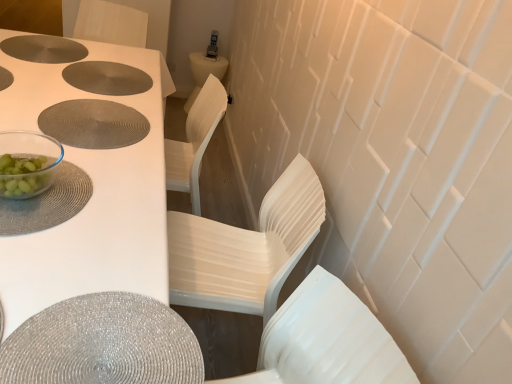
This screenshot has width=512, height=384. Identify the location of unoccupied area behind green glass bowl at upper left. (56, 150).